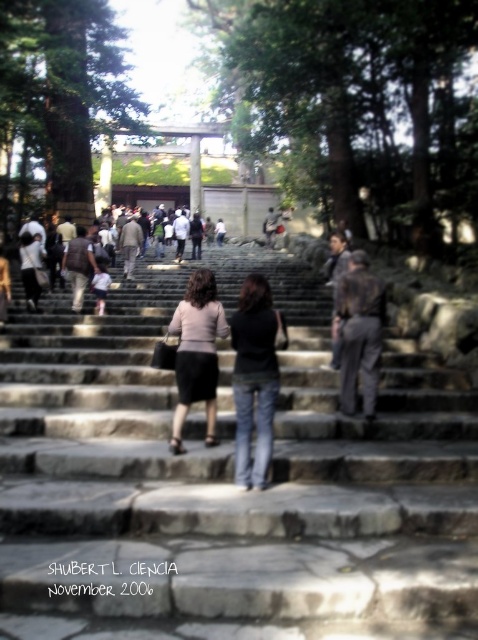
Is point (251, 387) in front of point (369, 394)?

That is True.

Is black denim jeans at center closer to the viewer compared to dark gray suit at center?

Yes, black denim jeans at center is closer to the viewer.

Does point (261, 381) lie behind point (349, 390)?

No.

Find the location of a particular element. The height and width of the screenshot is (640, 478). black denim jeans at center is located at coordinates (254, 378).

Does gray stone stairs at center appear under matte pink sweater at center?

Yes, gray stone stairs at center is below matte pink sweater at center.

Find the location of `gray stone stairs at center`. gray stone stairs at center is located at coordinates [227, 490].

The width and height of the screenshot is (478, 640). Find the location of `gray stone stairs at center`. gray stone stairs at center is located at coordinates (227, 490).

Can you confirm if black denim jeans at center is positioned above matte pink sweater at center?

No, black denim jeans at center is not above matte pink sweater at center.

Is black denim jeans at center taller than matte pink sweater at center?

Indeed, black denim jeans at center has a greater height compared to matte pink sweater at center.

The width and height of the screenshot is (478, 640). Find the location of `black denim jeans at center`. black denim jeans at center is located at coordinates (254, 378).